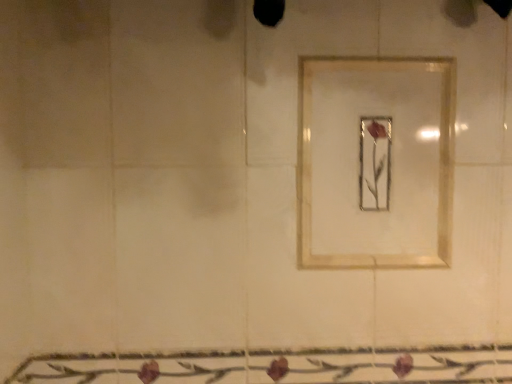
This screenshot has height=384, width=512. What do you see at coordinates (440, 163) in the screenshot? I see `gold metallic picture frame at center` at bounding box center [440, 163].

Locate an element on the screen. The width and height of the screenshot is (512, 384). gold metallic picture frame at center is located at coordinates (440, 163).

Image resolution: width=512 pixels, height=384 pixels. Identify the location of gold metallic picture frame at center. (440, 163).